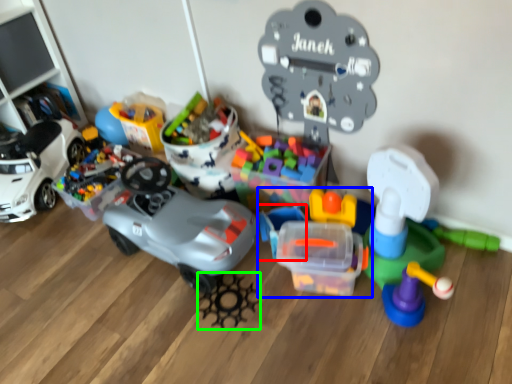
Question: Based on their relative distances, which object is nearer to toy (highlighted by a red box)? Choose from toy (highlighted by a blue box) and toy (highlighted by a green box).

Choices:
 (A) toy
 (B) toy

Answer: (A)